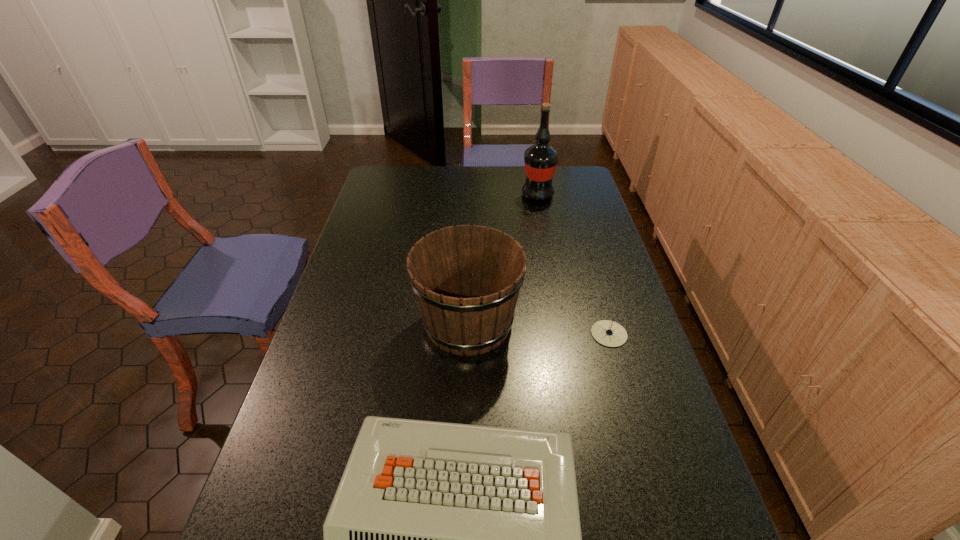
Identify the location of the tallest object. This screenshot has width=960, height=540. (541, 159).

Image resolution: width=960 pixels, height=540 pixels. I want to click on wine bottle, so click(541, 159).

Where is `wine bucket`? wine bucket is located at coordinates coord(466,279).

In order to click on the shortest object in this screenshot , I will do `click(608, 333)`.

I want to click on the rightmost object, so click(608, 333).

Where is `free point located 0.290m on the left of the wine bottle`? free point located 0.290m on the left of the wine bottle is located at coordinates (451, 195).

This screenshot has width=960, height=540. I want to click on free space located on the right of the wine bucket, so click(x=581, y=322).

Where is `vacant space located 0.340m on the back of the rightmost object`? This screenshot has width=960, height=540. vacant space located 0.340m on the back of the rightmost object is located at coordinates click(x=585, y=249).

Find the location of a particular element. object that is positioned at the far edge is located at coordinates (541, 159).

Where is `wine bottle that is positioned at the right edge`? The image size is (960, 540). wine bottle that is positioned at the right edge is located at coordinates (541, 159).